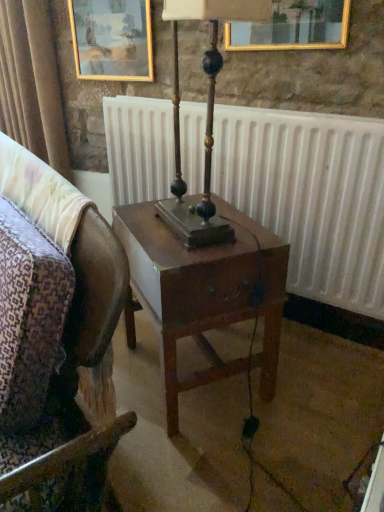
Question: Looking at their shapes, would you say wooden polished table lamp at center is wider or thinner than wooden chair at center?

Choices:
 (A) wide
 (B) thin

Answer: (B)

Question: Is point (206, 199) closer or farther from the camera than point (3, 179)?

Choices:
 (A) closer
 (B) farther

Answer: (B)

Question: Which of these objects is positioned farthest from the gold-framed painting at upper left?

Choices:
 (A) wooden chair at center
 (B) velvet curtain at upper left
 (C) wooden polished table lamp at center
 (D) white matte radiator at center

Answer: (A)

Question: Estimate the real-world distances between objects in this image. Which object is farther from the wooden chair at center?

Choices:
 (A) gold-framed painting at upper left
 (B) velvet curtain at upper left
 (C) white matte radiator at center
 (D) wooden polished table lamp at center

Answer: (B)